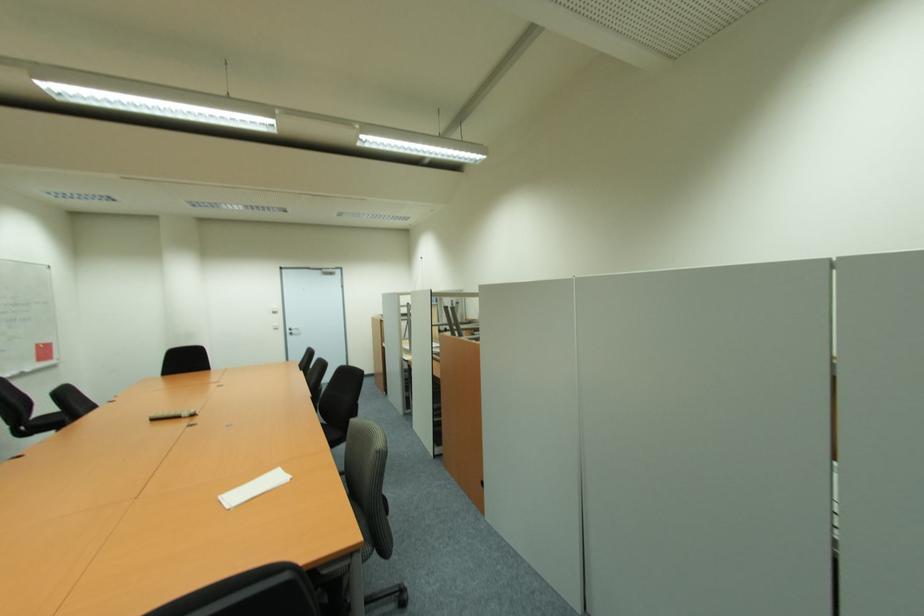
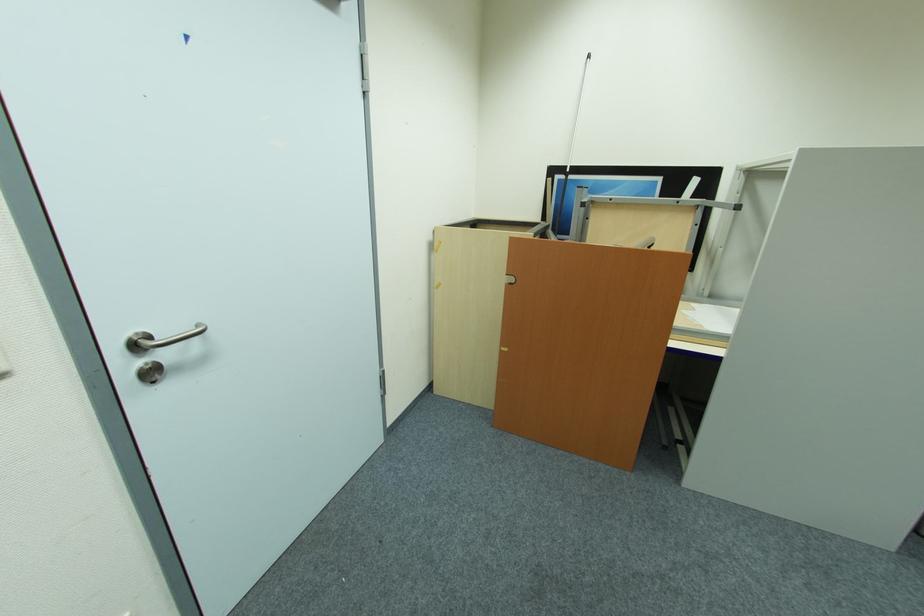
Find the pixel in the second image that matches point (295, 330) in the first image.

(141, 347)